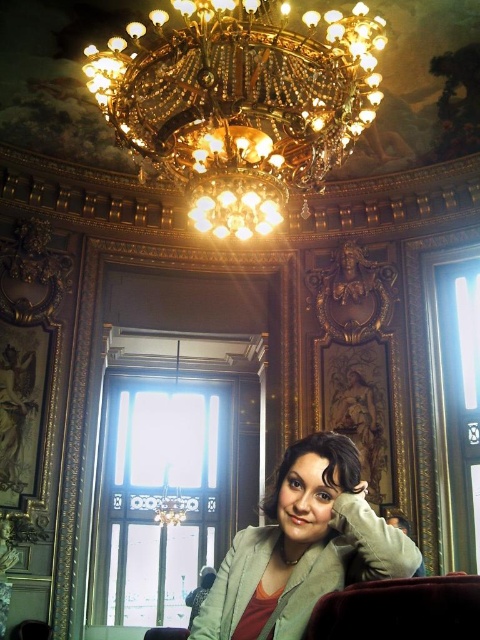
Is point (148, 125) less distant than point (387, 595)?

No, it is not.

Find the location of a particular element. This screenshot has width=480, height=640. gold crystal chandelier at upper center is located at coordinates (240, 104).

Between point (175, 145) and point (380, 627), which one is positioned in front?

Point (380, 627) is in front.

You are a GUI agent. You are given a task and a screenshot of the screen. Output one action in this format:
    pyautogui.click(x=<x>, y=<y>)
    Task: Click on the gold crystal chandelier at upper center
    The width and height of the screenshot is (480, 640).
    Given the screenshot: What is the action you would take?
    pyautogui.click(x=240, y=104)

Can you confirm if green matte jacket at lower right is bigger than velvet dark brown chair at lower center?

Actually, green matte jacket at lower right might be smaller than velvet dark brown chair at lower center.

Which is in front, point (284, 604) or point (458, 579)?

Positioned in front is point (458, 579).

The width and height of the screenshot is (480, 640). Find the location of `green matte jacket at lower right`. green matte jacket at lower right is located at coordinates (302, 547).

Is gold crystal chandelier at upper center bigger than green matte jacket at lower right?

Indeed, gold crystal chandelier at upper center has a larger size compared to green matte jacket at lower right.

At what (x,y) coordinates should I click in order to perform the action: click on gold crystal chandelier at upper center. Please return your answer as a coordinate pair (x, y). Looking at the image, I should click on (240, 104).

Between point (111, 90) and point (295, 612), which one is positioned behind?

The point (111, 90) is more distant.

At what (x,y) coordinates should I click in order to perform the action: click on gold crystal chandelier at upper center. Please return your answer as a coordinate pair (x, y). The height and width of the screenshot is (640, 480). Looking at the image, I should click on (240, 104).